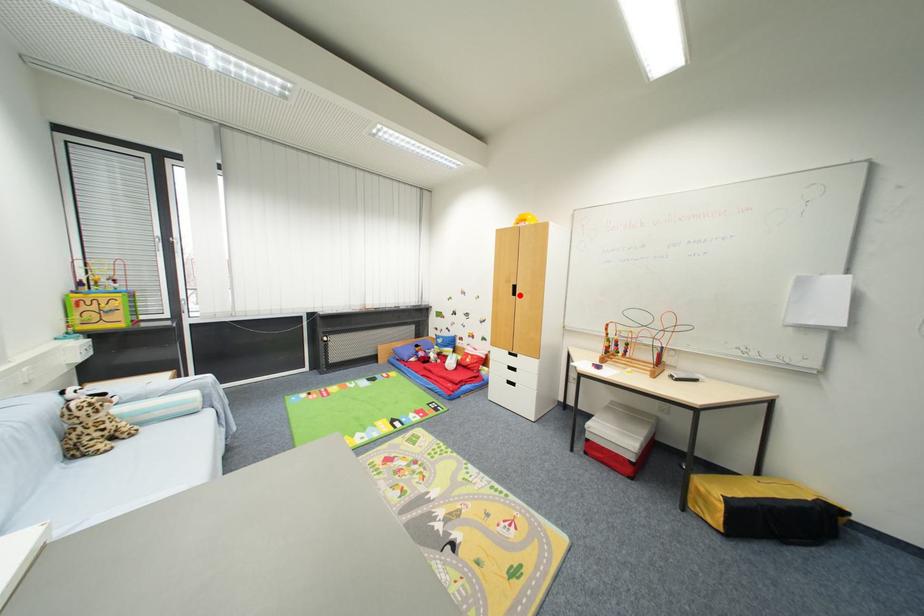
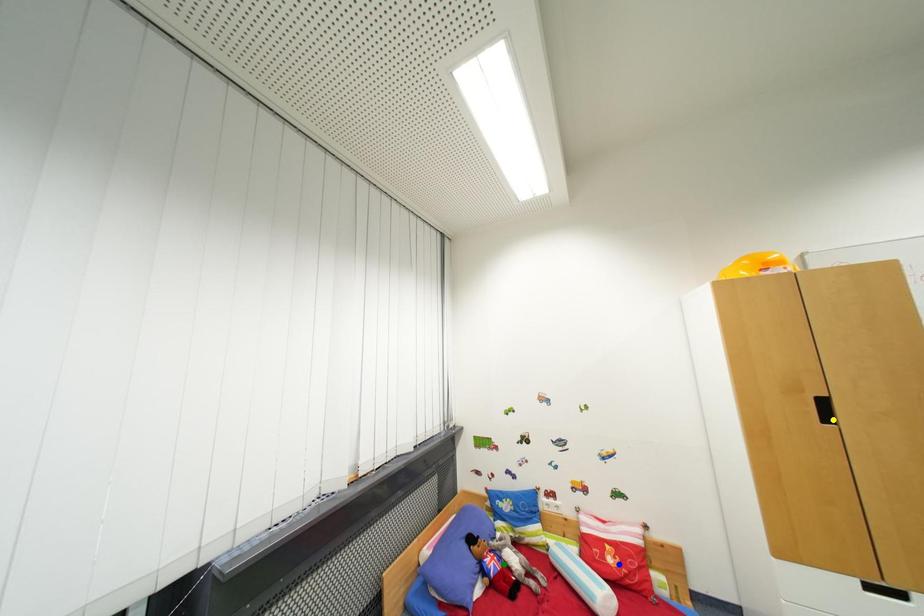
Question: I am providing you with two images of the same scene from different viewpoints. A red point is marked on the first image. You are given multiple points on the second image. Which point in image 2 represents the same 3d spot as the red point in image 1?

Choices:
 (A) blue point
 (B) green point
 (C) yellow point

Answer: (C)